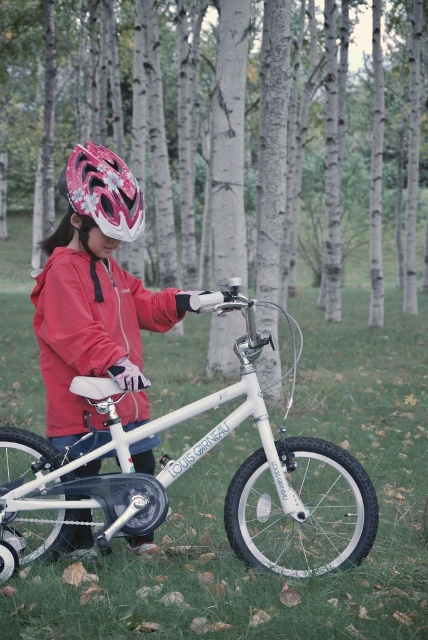
Question: Which point appears closest to the camera in this image?

Choices:
 (A) (285, 493)
 (B) (196, 76)
 (C) (121, 225)

Answer: (A)

Question: Does white matte bicycle at center appear over matte red jacket at center?

Choices:
 (A) no
 (B) yes

Answer: (A)

Question: Which of the following is the closest to the observer?

Choices:
 (A) (151, 300)
 (B) (95, 216)
 (C) (365, 538)

Answer: (B)

Question: Does white smooth tree at center lie behind matte pink helmet at upper left?

Choices:
 (A) no
 (B) yes

Answer: (B)

Question: Is white matte bicycle at center thinner than shiny pink helmet at upper center?

Choices:
 (A) no
 (B) yes

Answer: (A)

Question: Which point is closer to the camera taking this photo?

Choices:
 (A) (33, 292)
 (B) (2, 12)
 (C) (104, 188)
 (D) (172, 301)

Answer: (C)